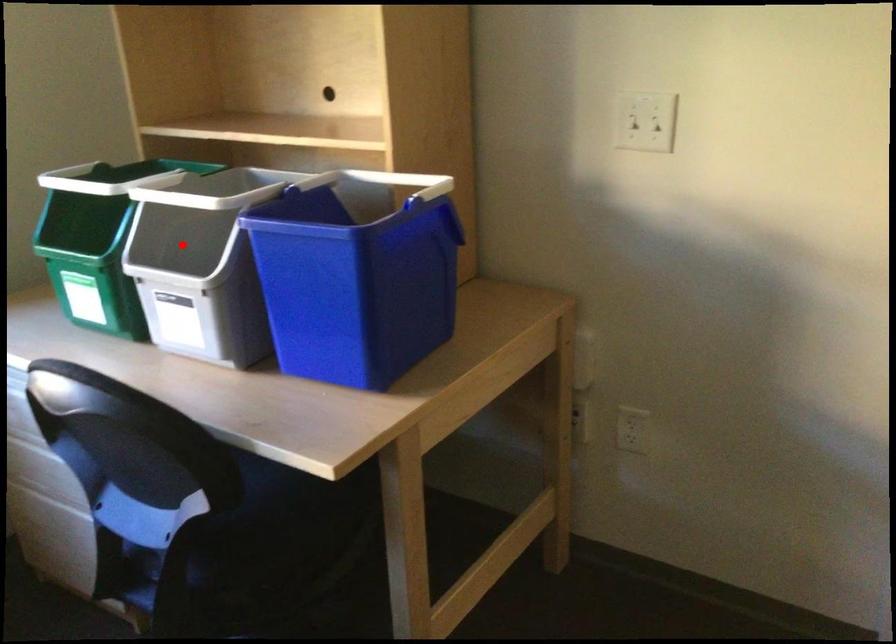
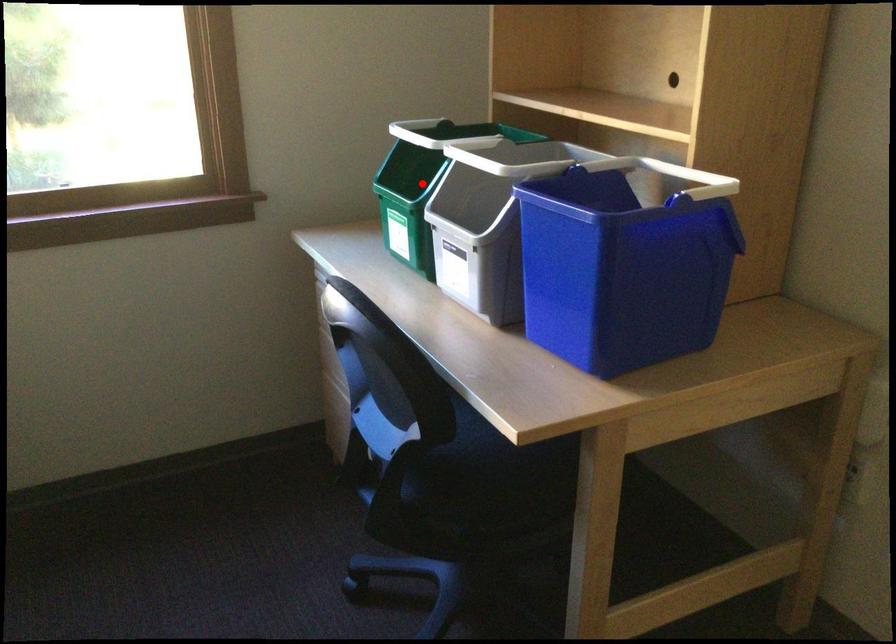
I am providing you with two images of the same scene from different viewpoints. A red point is marked on the first image and another point is marked on the second image. Does the point marked in image1 correspond to the same location as the one in image2?

No